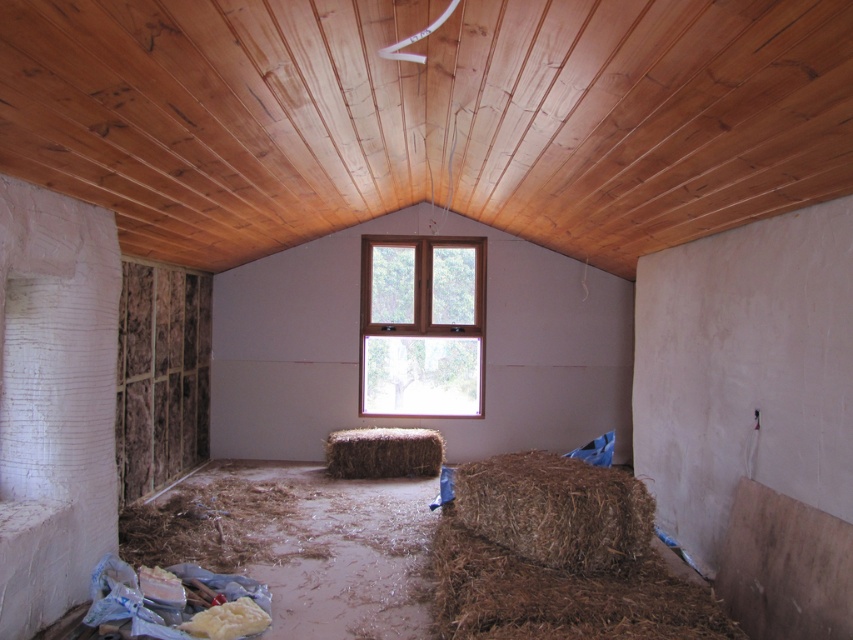
Is brown wooden window at center wider than brown rough hay at lower right?

Indeed, brown wooden window at center has a greater width compared to brown rough hay at lower right.

From the picture: Does brown wooden window at center appear on the right side of brown rough hay at lower right?

Incorrect, brown wooden window at center is not on the right side of brown rough hay at lower right.

Describe the element at coordinates (422, 321) in the screenshot. I see `brown wooden window at center` at that location.

Where is `brown wooden window at center`? brown wooden window at center is located at coordinates (422, 321).

In the scene shown: Between brown straw bale at lower right and brown wooden window at center, which one has more height?

A: brown wooden window at center is taller.

Who is positioned more to the left, brown straw bale at lower right or brown wooden window at center?

brown wooden window at center is more to the left.

Consider the image. Who is more forward, (x=434, y=582) or (x=459, y=268)?

Point (x=434, y=582)

Identify the location of brown straw bale at lower right. This screenshot has width=853, height=640. (558, 557).

Does brown wooden window at center have a lesser height compared to brown straw bale at center?

No.

Where is `brown wooden window at center`? The height and width of the screenshot is (640, 853). brown wooden window at center is located at coordinates (422, 321).

What are the coordinates of `brown wooden window at center` in the screenshot? It's located at (422, 321).